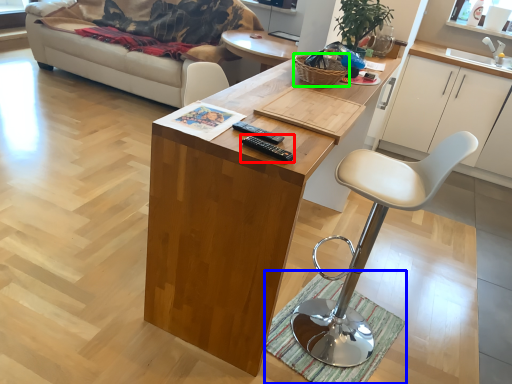
Question: Which object is positioned closest to remote (highlighted by a red box)? Select from mat (highlighted by a blue box) and basket (highlighted by a green box).

Choices:
 (A) mat
 (B) basket

Answer: (B)